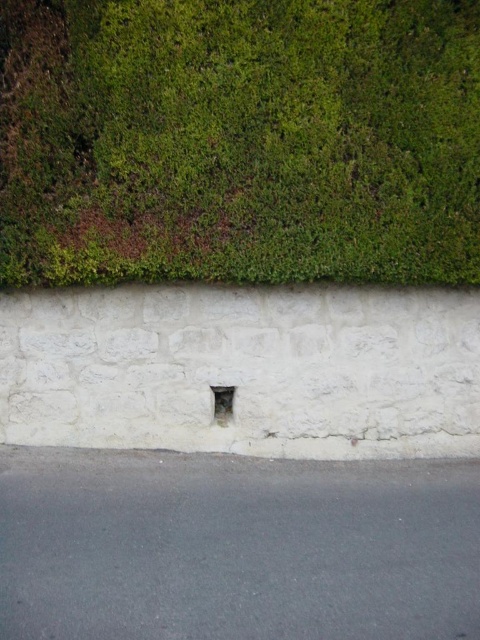
A bird is perched on the white stone hole at center and wants to fly up to the green mossy hedge at upper center. Given that the bird can jump 2 meters vertically, will it be able to reach the hedge?

The distance between the green mossy hedge at upper center and the white stone hole at center is 2.11 meters. Since the bird can only jump 2 meters vertically, it will not be able to reach the hedge.

Consider the image. You are a gardener trying to trim the green mossy hedge at upper center and the white stone hole at center. Which object requires more horizontal space to work around?

The green mossy hedge at upper center requires more horizontal space to work around because its width is larger than the white stone hole at center.

You are standing in front of a wall with a vent. There is a green mossy hedge at upper center. Where is the green mossy hedge located relative to the vent?

The green mossy hedge at upper center is located at point (239, 140) relative to the vent.